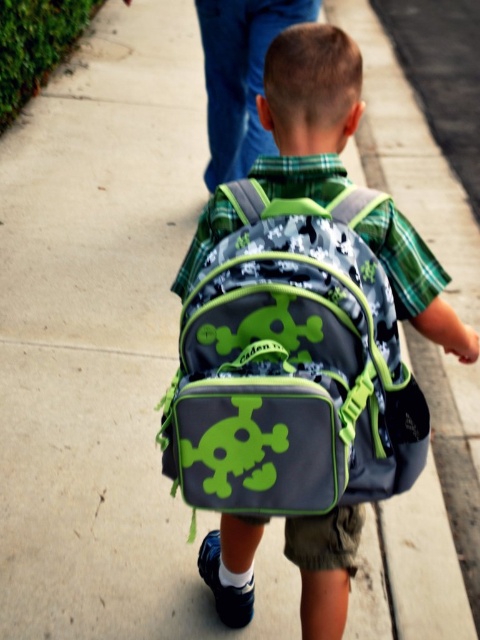
Question: Does matte gray backpack with green accents at center have a smaller size compared to matte black backpack at center?

Choices:
 (A) yes
 (B) no

Answer: (A)

Question: Does matte gray backpack with green accents at center appear over matte black backpack at center?

Choices:
 (A) no
 (B) yes

Answer: (A)

Question: Which object appears farthest from the camera in this image?

Choices:
 (A) matte gray backpack with green accents at center
 (B) matte black backpack at center

Answer: (B)

Question: Does matte gray backpack with green accents at center have a greater width compared to matte black backpack at center?

Choices:
 (A) no
 (B) yes

Answer: (A)

Question: Which point is farther to the camera?

Choices:
 (A) matte black backpack at center
 (B) matte gray backpack with green accents at center

Answer: (A)

Question: Among these objects, which one is farthest from the camera?

Choices:
 (A) matte black backpack at center
 (B) matte gray backpack with green accents at center

Answer: (A)